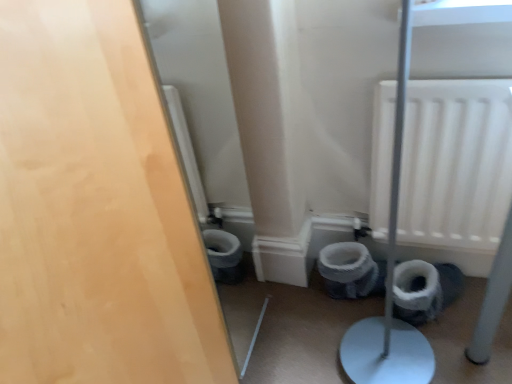
Question: Can you confirm if matte wood door at left is taller than white fabric toilet bowl at lower center?

Choices:
 (A) no
 (B) yes

Answer: (B)

Question: Is matte wood door at left with white fabric toilet bowl at lower center?

Choices:
 (A) yes
 (B) no

Answer: (B)

Question: Is matte wood door at left positioned beyond the bounds of white fabric toilet bowl at lower center?

Choices:
 (A) no
 (B) yes

Answer: (B)

Question: Is matte wood door at left surrounding white fabric toilet bowl at lower center?

Choices:
 (A) yes
 (B) no

Answer: (B)

Question: Does matte wood door at left have a smaller size compared to white fabric toilet bowl at lower center?

Choices:
 (A) yes
 (B) no

Answer: (B)

Question: Does matte wood door at left have a lesser height compared to white fabric toilet bowl at lower center?

Choices:
 (A) yes
 (B) no

Answer: (B)

Question: Is white fabric toilet bowl at lower center turned away from white textured toilet paper at lower right?

Choices:
 (A) yes
 (B) no

Answer: (A)

Question: Considering the relative sizes of white fabric toilet bowl at lower center and white textured toilet paper at lower right in the image provided, is white fabric toilet bowl at lower center wider than white textured toilet paper at lower right?

Choices:
 (A) yes
 (B) no

Answer: (A)

Question: Considering the relative sizes of white fabric toilet bowl at lower center and white textured toilet paper at lower right in the image provided, is white fabric toilet bowl at lower center smaller than white textured toilet paper at lower right?

Choices:
 (A) yes
 (B) no

Answer: (B)

Question: Is white fabric toilet bowl at lower center taller than white textured toilet paper at lower right?

Choices:
 (A) no
 (B) yes

Answer: (B)

Question: Does white fabric toilet bowl at lower center lie behind white textured toilet paper at lower right?

Choices:
 (A) no
 (B) yes

Answer: (B)

Question: From the image's perspective, is white fabric toilet bowl at lower center beneath white textured toilet paper at lower right?

Choices:
 (A) yes
 (B) no

Answer: (B)

Question: Does matte wood door at left appear on the left side of white matte radiator at upper right?

Choices:
 (A) no
 (B) yes

Answer: (B)